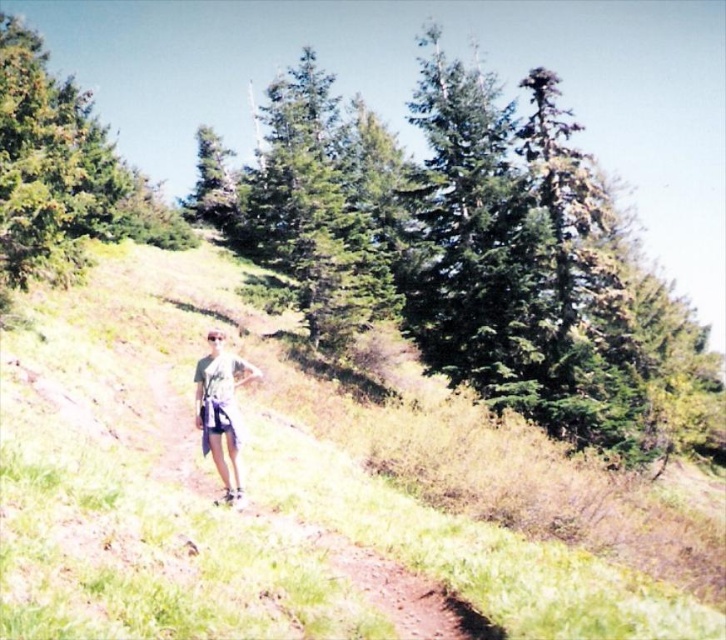
You are a hiker who wants to take a photo of the white cotton shorts at center and the green textured pine tree at center. Which object should you focus on first if you want to capture both in the same frame without moving your camera?

The green textured pine tree at center is much taller than the white cotton shorts at center, so you should focus on the green textured pine tree at center first to ensure it fits in the frame.

Looking at this image, you are a hiker who wants to take a shortcut from the green textured pine tree at center to the gravel path at center. Since you are carrying a heavy backpack, you need to know which is closer to you. Which object is nearer to you?

The green textured pine tree at center is closer to you because it is positioned further to the viewer than the gravel path at center, meaning the pine tree is nearer in the scene.

You are standing at the point marked as point (473,253) in the image. Looking around, you see a green textured pine tree at center. Which direction should you walk to reach the dirt path?

The green textured pine tree at center is located at point (473,253). Since the dirt path is in the foreground and the pine tree is at the center, you should walk towards the foreground to reach the dirt path.